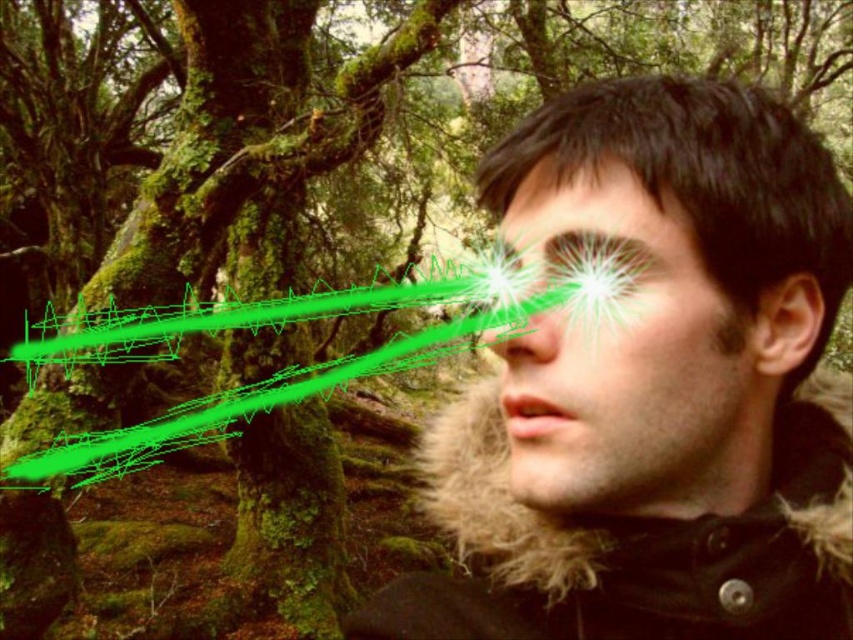
Question: Which point is closer to the camera?

Choices:
 (A) matte black face at center
 (B) dark brown fur coat at center

Answer: (A)

Question: Can you confirm if dark brown fur coat at center is positioned to the right of matte black face at center?

Choices:
 (A) yes
 (B) no

Answer: (A)

Question: Can you confirm if dark brown fur coat at center is positioned below matte black face at center?

Choices:
 (A) yes
 (B) no

Answer: (A)

Question: Is dark brown fur coat at center bigger than matte black face at center?

Choices:
 (A) no
 (B) yes

Answer: (B)